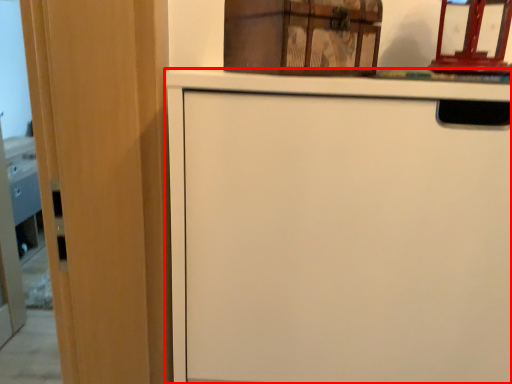
Question: From the image's perspective, considering the relative positions of cabinetry (annotated by the red box) and cabinetry in the image provided, where is cabinetry (annotated by the red box) located with respect to the staircase?

Choices:
 (A) above
 (B) below

Answer: (B)